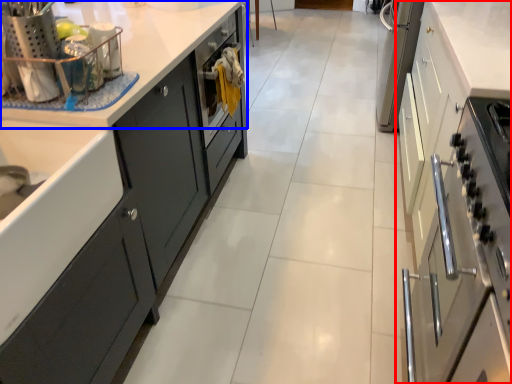
Question: Which of the following is the closest to the observer, cabinetry (highlighted by a red box) or countertop (highlighted by a blue box)?

Choices:
 (A) cabinetry
 (B) countertop

Answer: (A)